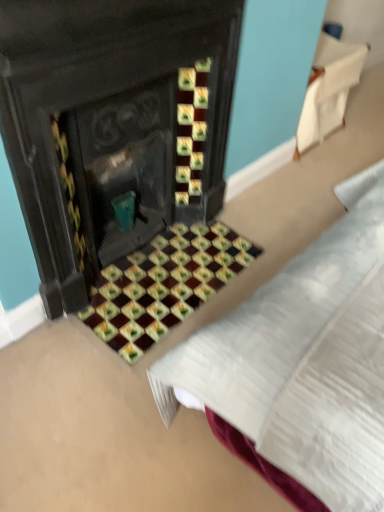
This screenshot has height=512, width=384. In order to click on free point above marble mosaic tiles at center (from a real-world perspective) in this screenshot , I will do tap(131, 292).